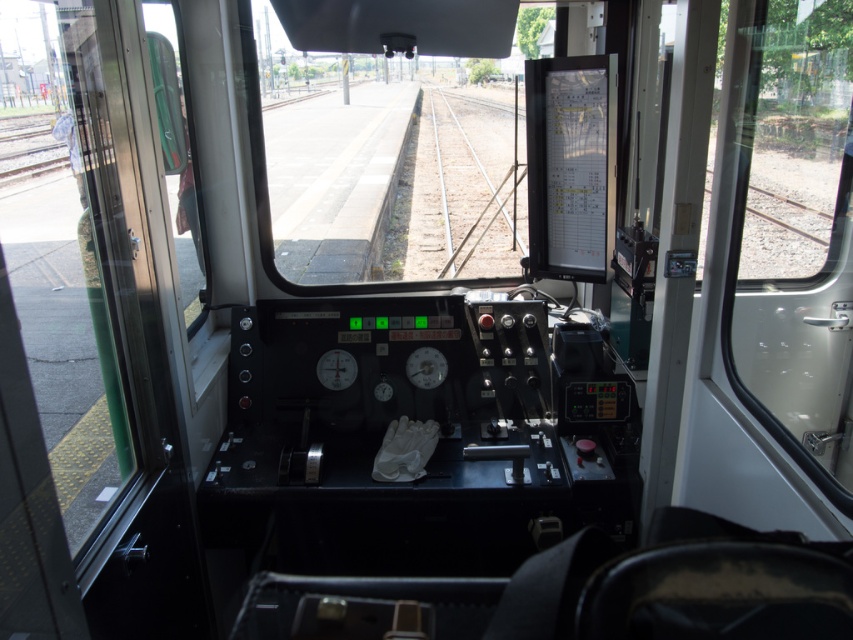
Question: Among these points, which one is farthest from the camera?

Choices:
 (A) (463, 260)
 (B) (717, 202)

Answer: (A)

Question: Is transparent glass window at right thinner than metallic silver train track at center?

Choices:
 (A) yes
 (B) no

Answer: (B)

Question: Is transparent glass window at right in front of metallic silver train track at center?

Choices:
 (A) yes
 (B) no

Answer: (A)

Question: Is transparent glass window at right positioned before metallic silver train track at center?

Choices:
 (A) no
 (B) yes

Answer: (B)